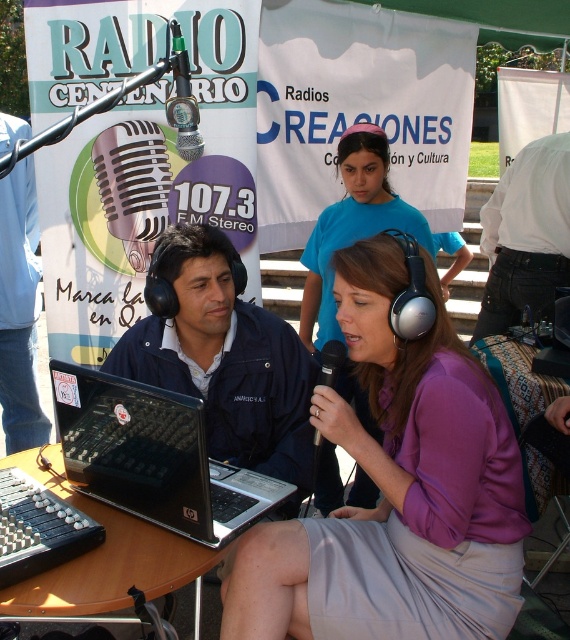
Question: Considering the real-world distances, which object is farthest from the black plastic laptop at center?

Choices:
 (A) dark blue jacket at center
 (B) black plastic round table at center
 (C) purple matte shirt at center
 (D) black metallic microphone at center

Answer: (D)

Question: Which object is positioned closest to the purple matte headphones at center?

Choices:
 (A) purple matte shirt at center
 (B) white cotton shirt at right
 (C) black plastic round table at center
 (D) black plastic laptop at center

Answer: (A)

Question: Which is nearer to the black plastic laptop at center?

Choices:
 (A) purple matte shirt at center
 (B) purple matte headphones at center
 (C) black plastic round table at center

Answer: (C)

Question: Can you confirm if purple matte headphones at center is positioned to the left of black metallic microphone at center?

Choices:
 (A) yes
 (B) no

Answer: (B)

Question: Considering the relative positions of purple matte shirt at center and black metallic microphone at center in the image provided, where is purple matte shirt at center located with respect to black metallic microphone at center?

Choices:
 (A) right
 (B) left

Answer: (A)

Question: Is purple matte shirt at center to the right of purple matte headphones at center from the viewer's perspective?

Choices:
 (A) yes
 (B) no

Answer: (B)